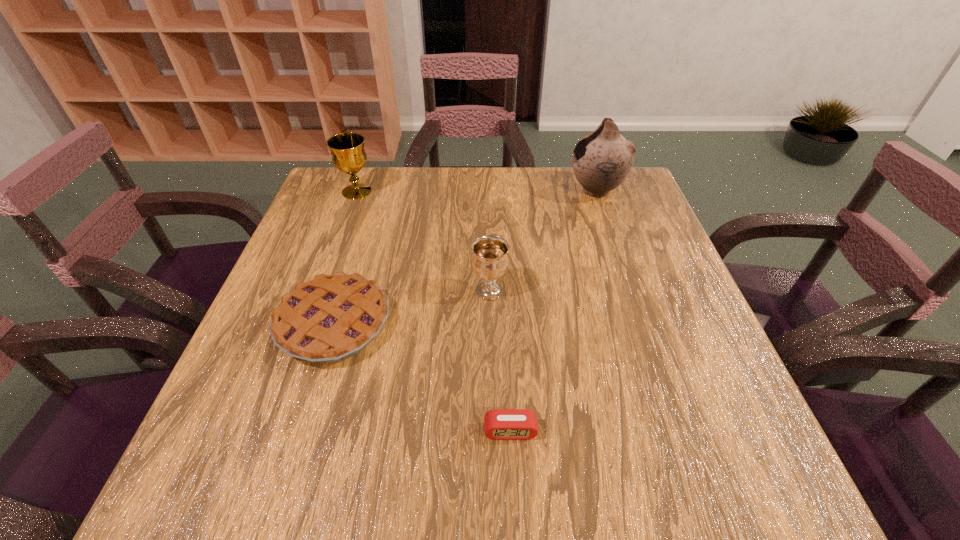
The image size is (960, 540). I want to click on free space located 0.080m from the spout of the tallest object, so click(x=540, y=190).

Locate an element on the screen. Image resolution: width=960 pixels, height=540 pixels. blank area located 0.220m from the spout of the tallest object is located at coordinates (490, 190).

Where is `free space located 0.310m on the front of the farther chalice`? Image resolution: width=960 pixels, height=540 pixels. free space located 0.310m on the front of the farther chalice is located at coordinates (324, 280).

I want to click on vacant area situated on the left of the shorter chalice, so click(x=340, y=291).

This screenshot has height=540, width=960. In order to click on vacant space located on the back of the second shortest object in this screenshot , I will do `click(371, 206)`.

This screenshot has width=960, height=540. Find the location of `pottery that is at the far edge`. pottery that is at the far edge is located at coordinates (601, 161).

Where is `chalice at the far edge`? chalice at the far edge is located at coordinates (x=347, y=150).

You are a GUI agent. You are given a task and a screenshot of the screen. Output one action in this format:
    pyautogui.click(x=<x>, y=<y>)
    Task: Click on the chalice that is at the left edge
    The width and height of the screenshot is (960, 540).
    Given the screenshot: What is the action you would take?
    pyautogui.click(x=347, y=150)

Identify the location of pie that is at the left edge. (331, 318).

Image resolution: width=960 pixels, height=540 pixels. In order to click on object situated at the right edge in this screenshot , I will do `click(601, 161)`.